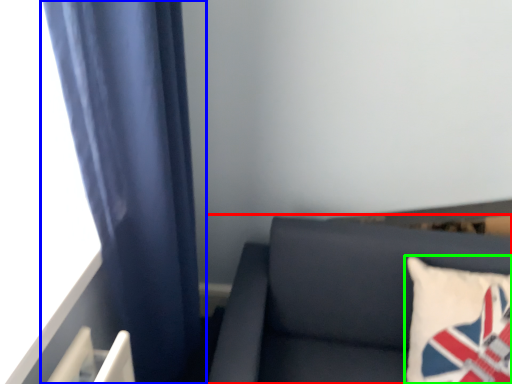
Question: Which is farther away from furniture (highlighted by a red box)? curtain (highlighted by a blue box) or pillow (highlighted by a green box)?

Choices:
 (A) curtain
 (B) pillow

Answer: (A)